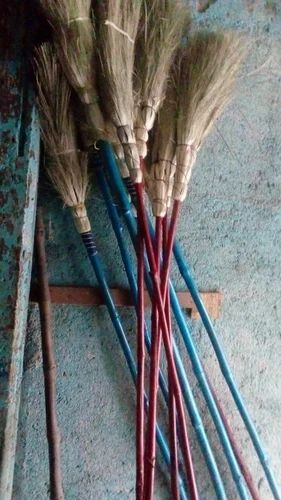
At what (x,y) coordinates should I click in order to perform the action: click on handle. Please return your answer as a coordinate pair (x, y). Looking at the image, I should click on (216, 467).